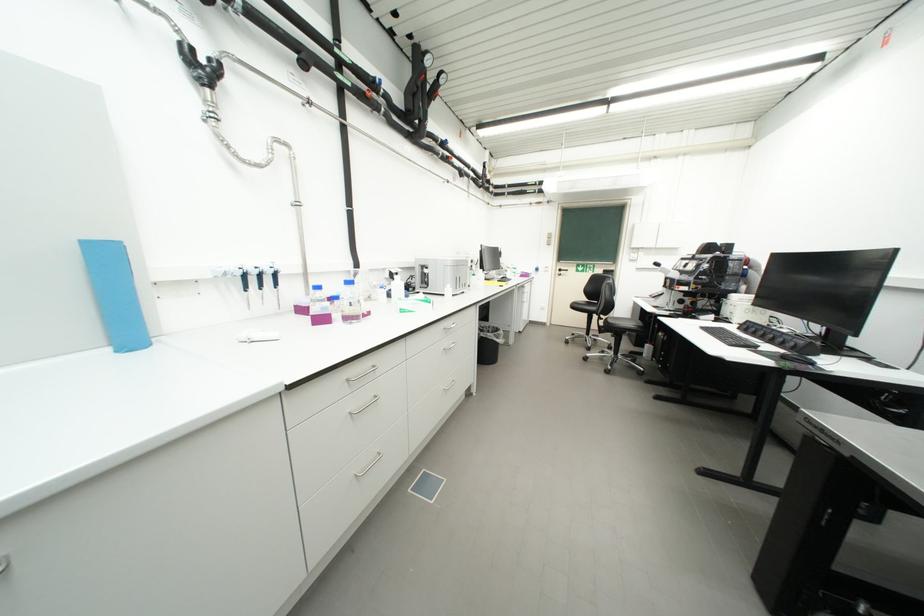
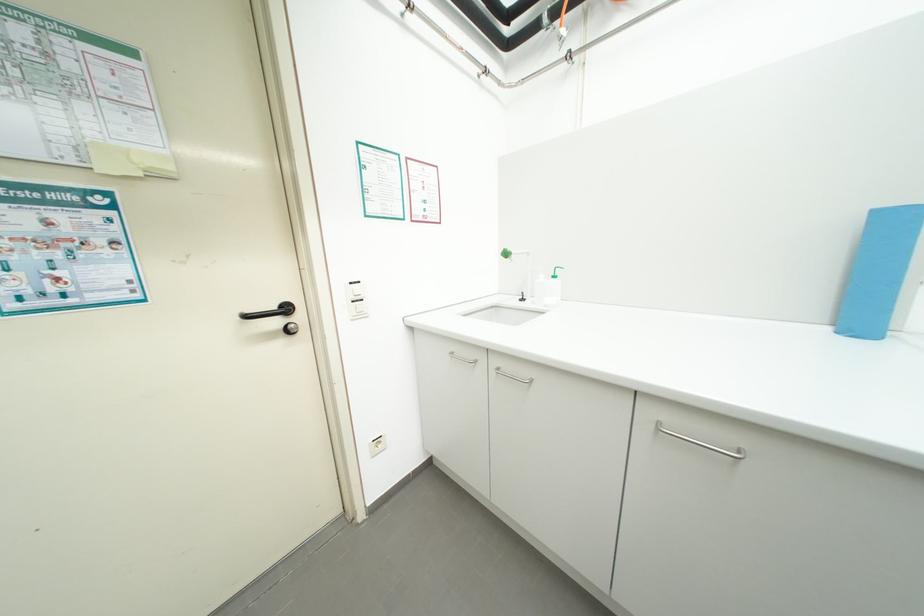
In the second image, find the point that corresponds to point (117, 351) in the first image.

(835, 330)